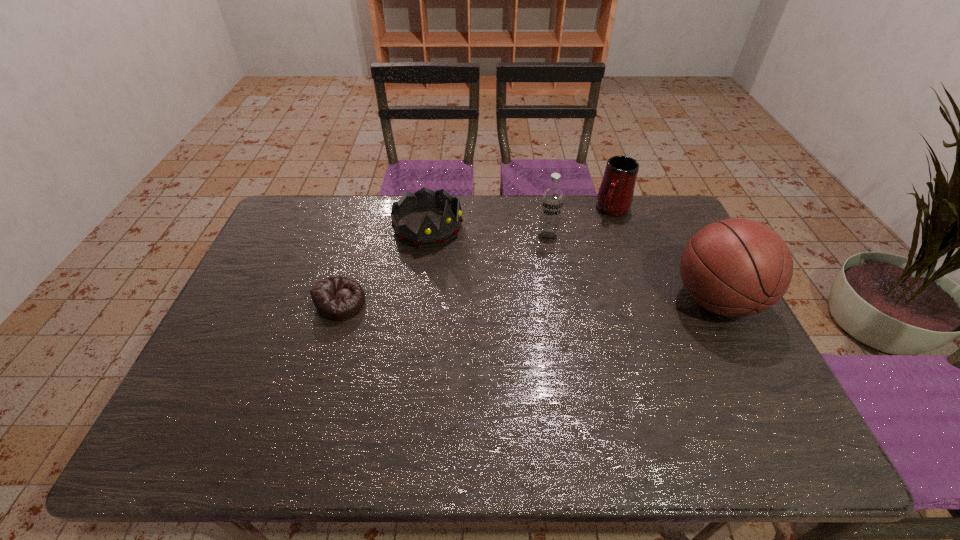
This screenshot has height=540, width=960. I want to click on unoccupied position between the third object from right to left and the tiara, so click(488, 232).

You are a GUI agent. You are given a task and a screenshot of the screen. Output one action in this format:
    pyautogui.click(x=<x>, y=<y>)
    Task: Click on the free space that is in between the third object from left to right and the rightmost object
    
    Given the screenshot: What is the action you would take?
    tap(632, 269)

This screenshot has height=540, width=960. I want to click on free space between the third object from right to left and the second object from right to left, so click(581, 224).

Find the location of a particular element. empty space between the basketball and the third object from right to left is located at coordinates 632,269.

Locate an element on the screen. The image size is (960, 540). free space that is in between the fourth object from left to right and the beanbag is located at coordinates (477, 256).

Where is `free space between the leftmost object and the basketball`? This screenshot has height=540, width=960. free space between the leftmost object and the basketball is located at coordinates (528, 302).

Find the location of `free space that is in between the leftmost object and the rightmost object`. free space that is in between the leftmost object and the rightmost object is located at coordinates (528, 302).

Where is `blank region between the tiara and the rightmost object`? blank region between the tiara and the rightmost object is located at coordinates (572, 264).

At what (x,y) coordinates should I click in order to perform the action: click on free space between the leftmost object and the second object from right to left. Please return your answer as a coordinate pair (x, y). This screenshot has height=540, width=960. Looking at the image, I should click on (477, 256).

Locate which object is the fourth closest to the beanbag. Please provide its 2D coordinates. Your answer should be formatted as a tuple, i.e. [(x, y)], where the tuple contains the x and y coordinates of a point satisfying the conditions above.

[(734, 267)]